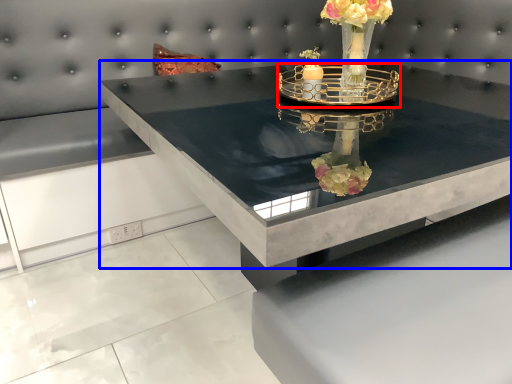
Question: Among these objects, which one is nearest to the camera, candle holder (highlighted by a red box) or table (highlighted by a blue box)?

Choices:
 (A) candle holder
 (B) table

Answer: (B)